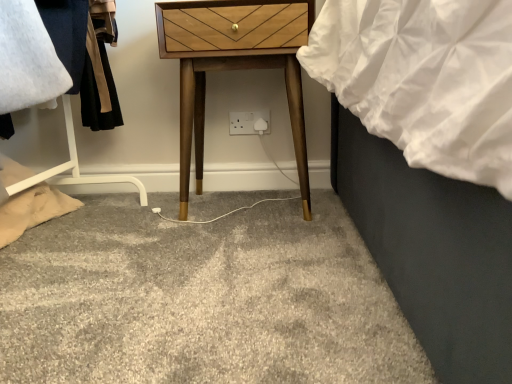
Question: From their relative heights in the image, would you say woodenmaterial/texturenightstand at center is taller or shorter than white plastic socket at center?

Choices:
 (A) tall
 (B) short

Answer: (A)

Question: Is woodenmaterial/texturenightstand at center inside the boundaries of white plastic socket at center, or outside?

Choices:
 (A) outside
 (B) inside

Answer: (A)

Question: From the image's perspective, is woodenmaterial/texturenightstand at center located above or below white plastic socket at center?

Choices:
 (A) above
 (B) below

Answer: (A)

Question: In the image, is white plastic socket at center positioned in front of or behind woodenmaterial/texturenightstand at center?

Choices:
 (A) behind
 (B) front

Answer: (A)

Question: From a real-world perspective, is white plastic socket at center physically located above or below woodenmaterial/texturenightstand at center?

Choices:
 (A) above
 (B) below

Answer: (B)

Question: Is white plastic socket at center taller or shorter than woodenmaterial/texturenightstand at center?

Choices:
 (A) short
 (B) tall

Answer: (A)

Question: From the image's perspective, is white plastic socket at center above or below woodenmaterial/texturenightstand at center?

Choices:
 (A) above
 (B) below

Answer: (B)